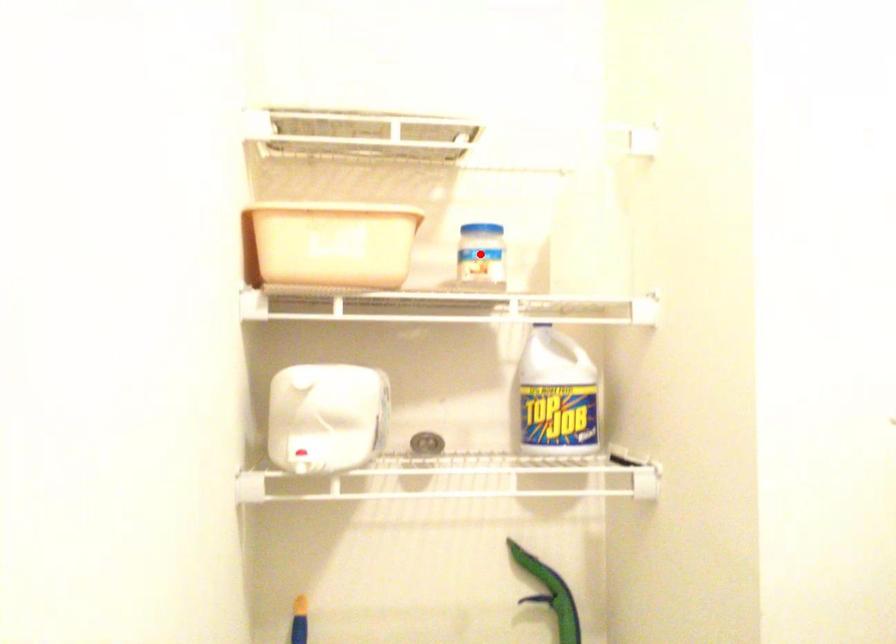
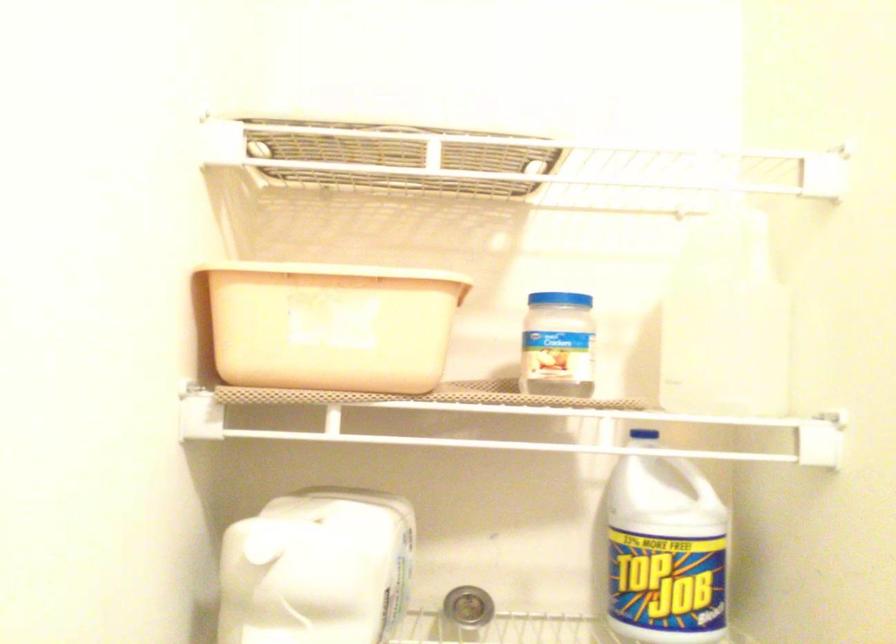
Locate, in the second image, the point that corresponds to the highlighted location in the first image.

(558, 342)